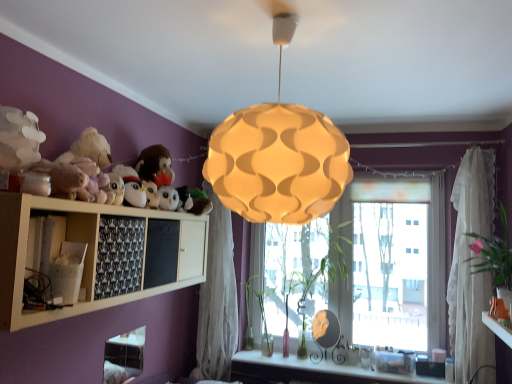
At what (x,y) coordinates should I click in order to perform the action: click on green glass vase at window, which is counted as the second plant, starting from the back. Please return your answer as a coordinate pair (x, y). Image resolution: width=512 pixels, height=384 pixels. Looking at the image, I should click on (264, 325).

What do you see at coordinates (498, 328) in the screenshot?
I see `matte white table at lower right` at bounding box center [498, 328].

Identify the location of matte yellow pendant light at center. (278, 156).

Identify the location of green leafy plant at right, which is the first plant from right to left. The height and width of the screenshot is (384, 512). (x=494, y=254).

In terms of width, does white sheer curtain at center, the 1th curtain from the back, look wider or thinner when compared to green leafy plant at right, which ranks as the first plant in front-to-back order?

white sheer curtain at center, the 1th curtain from the back, is thinner than green leafy plant at right, which ranks as the first plant in front-to-back order.

From a real-world perspective, who is located lower, white sheer curtain at center, arranged as the first curtain when viewed from the left, or green leafy plant at right, which is the first plant from right to left?

white sheer curtain at center, arranged as the first curtain when viewed from the left, is physically lower.

Considering the sizes of objects white sheer curtain at center, arranged as the first curtain when viewed from the left, and green leafy plant at right, which is the 4th plant in left-to-right order, in the image provided, who is bigger, white sheer curtain at center, arranged as the first curtain when viewed from the left, or green leafy plant at right, which is the 4th plant in left-to-right order,?

Bigger between the two is white sheer curtain at center, arranged as the first curtain when viewed from the left.

Does white sheer curtain at center, arranged as the first curtain when viewed from the left, have a lesser height compared to green leafy plant at right, which ranks as the fourth plant in back-to-front order?

No.

Which is in front, white glossy vanity at lower center or matte yellow pendant light at center?

matte yellow pendant light at center is more forward.

Is white glossy vanity at lower center next to matte yellow pendant light at center and touching it?

No.

How much distance is there between white glossy vanity at lower center and matte yellow pendant light at center?

white glossy vanity at lower center and matte yellow pendant light at center are 2.04 meters apart from each other.

Looking at this image, which is closer to the camera, (361, 372) or (277, 198)?

Positioned in front is point (277, 198).

In the scene shown: Is white lace curtain at right, arranged as the first curtain when viewed from the right, turned away from matte yellow pendant light at center?

No, matte yellow pendant light at center is not at the back of white lace curtain at right, arranged as the first curtain when viewed from the right.

Considering the relative sizes of white lace curtain at right, acting as the second curtain starting from the left, and matte yellow pendant light at center in the image provided, is white lace curtain at right, acting as the second curtain starting from the left, smaller than matte yellow pendant light at center?

Yes, white lace curtain at right, acting as the second curtain starting from the left, is smaller than matte yellow pendant light at center.

Between white lace curtain at right, the 1th curtain in the front-to-back sequence, and matte yellow pendant light at center, which one has larger width?

matte yellow pendant light at center.

You are a GUI agent. You are given a task and a screenshot of the screen. Output one action in this format:
    pyautogui.click(x=<x>, y=<y>)
    Task: Click on the 1st curtain positioned below the matte yellow pendant light at center (from the image's perspective)
    The width and height of the screenshot is (512, 384).
    Given the screenshot: What is the action you would take?
    pyautogui.click(x=471, y=265)

From the image's perspective, which is below, black fabric at lower left, which ranks as the 1th shelf in right-to-left order, or matte yellow pendant light at center?

black fabric at lower left, which ranks as the 1th shelf in right-to-left order, from the image's perspective.

Is black fabric at lower left, the second shelf when ordered from left to right, positioned beyond the bounds of matte yellow pendant light at center?

Yes, black fabric at lower left, the second shelf when ordered from left to right, is outside of matte yellow pendant light at center.

From a real-world perspective, does black fabric at lower left, the second shelf when ordered from left to right, stand above matte yellow pendant light at center?

Actually, black fabric at lower left, the second shelf when ordered from left to right, is physically below matte yellow pendant light at center in the real world.

Does black fabric at lower left, the second shelf when ordered from left to right, turn towards matte yellow pendant light at center?

No.

Considering the relative sizes of green glass vase at window, which is counted as the second plant, starting from the back, and white lace curtain at right, the 1th curtain in the front-to-back sequence, in the image provided, is green glass vase at window, which is counted as the second plant, starting from the back, wider than white lace curtain at right, the 1th curtain in the front-to-back sequence,?

Incorrect, the width of green glass vase at window, which is counted as the second plant, starting from the back, does not surpass that of white lace curtain at right, the 1th curtain in the front-to-back sequence.

Does green glass vase at window, which appears as the 3th plant when viewed from the front, come behind white lace curtain at right, acting as the second curtain starting from the left?

That is True.

Considering the relative positions of green glass vase at window, arranged as the third plant when viewed from the right, and white lace curtain at right, the 1th curtain in the front-to-back sequence, in the image provided, is green glass vase at window, arranged as the third plant when viewed from the right, to the left or to the right of white lace curtain at right, the 1th curtain in the front-to-back sequence,?

Clearly, green glass vase at window, arranged as the third plant when viewed from the right, is on the left of white lace curtain at right, the 1th curtain in the front-to-back sequence, in the image.

Considering the sizes of objects green glass vase at window, which appears as the 3th plant when viewed from the front, and white lace curtain at right, the 1th curtain in the front-to-back sequence, in the image provided, who is bigger, green glass vase at window, which appears as the 3th plant when viewed from the front, or white lace curtain at right, the 1th curtain in the front-to-back sequence,?

white lace curtain at right, the 1th curtain in the front-to-back sequence, is bigger.

Locate an element on the screen. table lying in front of the white sheer curtain at center, the 2th curtain in the right-to-left sequence is located at coordinates (498, 328).

Is white sheer curtain at center, arranged as the 2th curtain when viewed from the front, in front of or behind matte white table at lower right in the image?

white sheer curtain at center, arranged as the 2th curtain when viewed from the front, is behind matte white table at lower right.

How much distance is there between white sheer curtain at center, the 2th curtain in the right-to-left sequence, and matte white table at lower right?

The distance of white sheer curtain at center, the 2th curtain in the right-to-left sequence, from matte white table at lower right is 1.84 meters.

From the image's perspective, is white sheer curtain at center, the 2th curtain in the right-to-left sequence, positioned above or below matte white table at lower right?

Clearly, from the image's perspective, white sheer curtain at center, the 2th curtain in the right-to-left sequence, is above matte white table at lower right.

From the picture: Measure the distance between matte white table at lower right and green matte plant at center, the 3th plant when ordered from back to front.

matte white table at lower right is 1.30 meters away from green matte plant at center, the 3th plant when ordered from back to front.

Where is `table that appears below the green matte plant at center, the second plant positioned from the front (from a real-world perspective)`? table that appears below the green matte plant at center, the second plant positioned from the front (from a real-world perspective) is located at coordinates coord(498,328).

What's the angular difference between matte white table at lower right and green matte plant at center, which appears as the 2th plant when viewed from the right,'s facing directions?

matte white table at lower right and green matte plant at center, which appears as the 2th plant when viewed from the right, are facing 91.5 degrees away from each other.

Which is in front, point (508, 338) or point (297, 232)?

The point (508, 338) is closer to the camera.

Identify the location of plant that appears above the white sheer curtain at center, the 2th curtain in the right-to-left sequence (from the image's perspective). This screenshot has width=512, height=384. (494, 254).

Find the location of `vanity behind the matte yellow pendant light at center`. vanity behind the matte yellow pendant light at center is located at coordinates (315, 371).

Estimate the real-world distances between objects in this image. Which object is closer to white matte cabinet at left, which ranks as the first shelf in left-to-right order, white glossy vanity at lower center or matte yellow pendant light at center?

matte yellow pendant light at center lies closer to white matte cabinet at left, which ranks as the first shelf in left-to-right order, than the other object.

When comparing their distances from green glass vase at window, the 1th plant viewed from the back, does matte yellow pendant light at center or white plush toy at upper center, the second toy viewed from the top, seem closer?

white plush toy at upper center, the second toy viewed from the top.

Looking at the image, which one is located further to white glossy vanity at lower center, green glass vase at window, which appears as the 3th plant when viewed from the front, or white plush toy at upper center, which appears as the second toy when viewed from the left?

white plush toy at upper center, which appears as the second toy when viewed from the left.

Consider the image. Which object lies further to the anchor point fluffy white stuffed animal at upper left, the 1th toy in the front-to-back sequence, white plush toy at upper center, the second toy viewed from the top, or green glass vase at window, the 4th plant when ordered from right to left?

green glass vase at window, the 4th plant when ordered from right to left, is further to fluffy white stuffed animal at upper left, the 1th toy in the front-to-back sequence.

From the image, which object appears to be nearer to white sheer curtain at center, arranged as the first curtain when viewed from the left, black fabric at lower left, the second shelf when ordered from left to right, or white plush toy at upper center, marked as the first toy in a right-to-left arrangement?

white plush toy at upper center, marked as the first toy in a right-to-left arrangement, lies closer to white sheer curtain at center, arranged as the first curtain when viewed from the left, than the other object.

Estimate the real-world distances between objects in this image. Which object is further from white sheer curtain at center, arranged as the first curtain when viewed from the left, fluffy white stuffed animal at upper left, the second toy in the right-to-left sequence, or white lace curtain at right, the 1th curtain in the front-to-back sequence?

white lace curtain at right, the 1th curtain in the front-to-back sequence.

Looking at the image, which one is located further to fluffy white stuffed animal at upper left, the 1th toy from the left, green leafy plant at right, which is the first plant from right to left, or white sheer curtain at center, arranged as the first curtain when viewed from the left?

Among the two, green leafy plant at right, which is the first plant from right to left, is located further to fluffy white stuffed animal at upper left, the 1th toy from the left.

Based on their spatial positions, is white lace curtain at right, arranged as the first curtain when viewed from the right, or green matte plant at center, the 3th plant when ordered from back to front, closer to white plush toy at upper center, the 1th toy ordered from the bottom?

green matte plant at center, the 3th plant when ordered from back to front, is closer to white plush toy at upper center, the 1th toy ordered from the bottom.

Where is `shelf between white matte cabinet at left, which ranks as the first shelf in left-to-right order, and matte white table at lower right, in the horizontal direction`? The width and height of the screenshot is (512, 384). shelf between white matte cabinet at left, which ranks as the first shelf in left-to-right order, and matte white table at lower right, in the horizontal direction is located at coordinates (119, 256).

Where is `shelf located between white matte cabinet at left, which ranks as the first shelf in left-to-right order, and green leafy plant at right, which ranks as the first plant in front-to-back order, in the left-right direction`? Image resolution: width=512 pixels, height=384 pixels. shelf located between white matte cabinet at left, which ranks as the first shelf in left-to-right order, and green leafy plant at right, which ranks as the first plant in front-to-back order, in the left-right direction is located at coordinates (119, 256).

This screenshot has width=512, height=384. I want to click on table situated between white plush toy at upper center, the 1th toy ordered from the bottom, and white lace curtain at right, the 1th curtain in the front-to-back sequence, from left to right, so click(498, 328).

The image size is (512, 384). I want to click on curtain located between black fabric at lower left, which ranks as the 1th shelf in right-to-left order, and white lace curtain at right, placed as the 2th curtain when sorted from back to front, in the left-right direction, so click(x=217, y=298).